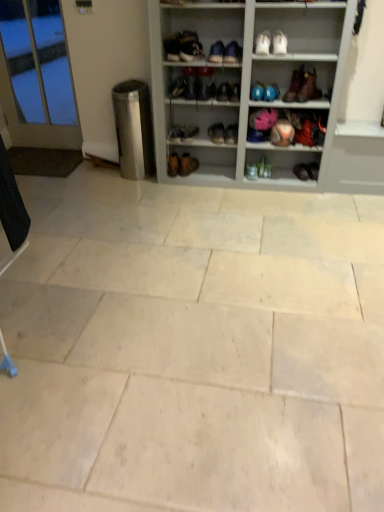
What do you see at coordinates (257, 91) in the screenshot? Image resolution: width=384 pixels, height=512 pixels. I see `blue matte shoes at upper center, marked as the 6th footwear in a left-to-right arrangement` at bounding box center [257, 91].

Describe the element at coordinates (235, 92) in the screenshot. I see `matte black shoe at center, which ranks as the 3th shoe in right-to-left order` at that location.

Find the location of a particular element. The height and width of the screenshot is (512, 384). matte pink shoe at upper right, positioned as the 3th footwear in right-to-left order is located at coordinates (294, 85).

This screenshot has height=512, width=384. Describe the element at coordinates (263, 42) in the screenshot. I see `white matte shoe at upper center, which is counted as the 6th footwear, starting from the right` at that location.

From the picture: Measure the distance between point (262, 47) and camera.

9.19 feet.

I want to click on blue matte shoes at upper center, which is the 5th footwear in right-to-left order, so click(257, 91).

Which is less distant, [233,93] or [182,80]?

Point [233,93]

Is matte black shoe at center, the 4th shoe when ordered from left to right, at the right side of matte black shoe at center, placed as the first shoe when sorted from left to right?

Yes, matte black shoe at center, the 4th shoe when ordered from left to right, is to the right of matte black shoe at center, placed as the first shoe when sorted from left to right.

From a real-world perspective, is matte black shoe at center, which ranks as the 3th shoe in right-to-left order, on top of matte black shoe at center, which is the 6th shoe from right to left?

No, from a real-world perspective, matte black shoe at center, which ranks as the 3th shoe in right-to-left order, is not above matte black shoe at center, which is the 6th shoe from right to left.

Who is bigger, matte black shoe at center, which ranks as the 3th shoe in right-to-left order, or matte black shoe at center, placed as the first shoe when sorted from left to right?

matte black shoe at center, placed as the first shoe when sorted from left to right, is bigger.

Is leather boot at center, acting as the eighth footwear starting from the right, at the right side of blue matte bowling ball at upper center, placed as the 5th shoe when sorted from left to right?

Incorrect, leather boot at center, acting as the eighth footwear starting from the right, is not on the right side of blue matte bowling ball at upper center, placed as the 5th shoe when sorted from left to right.

Considering the positions of objects leather boot at center, which appears as the third footwear when viewed from the left, and blue matte bowling ball at upper center, the second shoe viewed from the right, in the image provided, who is behind, leather boot at center, which appears as the third footwear when viewed from the left, or blue matte bowling ball at upper center, the second shoe viewed from the right,?

leather boot at center, which appears as the third footwear when viewed from the left, is further away from the camera.

Identify the location of shoe that is the 3rd one when counting rightward from the leather boot at center, which appears as the third footwear when viewed from the left. The height and width of the screenshot is (512, 384). (271, 92).

From the image's perspective, between leather boot at center, acting as the eighth footwear starting from the right, and blue matte bowling ball at upper center, the second shoe viewed from the right, who is located below?

leather boot at center, acting as the eighth footwear starting from the right, from the image's perspective.

Is matte black boot at upper center, which is counted as the 4th footwear, starting from the right, looking in the opposite direction of matte black shoe at center, which ranks as the 3th shoe in right-to-left order?

No, matte black boot at upper center, which is counted as the 4th footwear, starting from the right, is not facing the opposite direction of matte black shoe at center, which ranks as the 3th shoe in right-to-left order.

Between matte black boot at upper center, which is counted as the 4th footwear, starting from the right, and matte black shoe at center, the 4th shoe when ordered from left to right, which one has more height?

With more height is matte black shoe at center, the 4th shoe when ordered from left to right.

From the image's perspective, does matte black boot at upper center, the 7th footwear in the left-to-right sequence, appear higher than matte black shoe at center, which ranks as the 3th shoe in right-to-left order?

Yes, from the image's perspective, matte black boot at upper center, the 7th footwear in the left-to-right sequence, is on top of matte black shoe at center, which ranks as the 3th shoe in right-to-left order.

Are matte black boot at upper center, which is counted as the 4th footwear, starting from the right, and matte black shoe at center, the 4th shoe when ordered from left to right, located far from each other?

Answer: No, matte black boot at upper center, which is counted as the 4th footwear, starting from the right, is in close proximity to matte black shoe at center, the 4th shoe when ordered from left to right.

In the scene shown: Could you tell me if matte pink shoe at upper right, positioned as the 3th footwear in right-to-left order, is turned towards natural stone tile at center?

No, matte pink shoe at upper right, positioned as the 3th footwear in right-to-left order, is not turned towards natural stone tile at center.

From a real-world perspective, who is located higher, matte pink shoe at upper right, positioned as the 3th footwear in right-to-left order, or natural stone tile at center?

matte pink shoe at upper right, positioned as the 3th footwear in right-to-left order, is physically above.

From the image's perspective, who appears lower, matte pink shoe at upper right, positioned as the 3th footwear in right-to-left order, or natural stone tile at center?

From the image's view, natural stone tile at center is below.

Looking at this image, how different are the orientations of matte blue shoe at center, positioned as the 4th footwear in left-to-right order, and leather boot at center, acting as the eighth footwear starting from the right, in degrees?

12.2 degrees.

From a real-world perspective, between matte blue shoe at center, positioned as the 4th footwear in left-to-right order, and leather boot at center, acting as the eighth footwear starting from the right, who is vertically higher?

leather boot at center, acting as the eighth footwear starting from the right, is physically above.

In the scene shown: From the image's perspective, is matte blue shoe at center, which is the seventh footwear from right to left, located above or below leather boot at center, acting as the eighth footwear starting from the right?

Clearly, from the image's perspective, matte blue shoe at center, which is the seventh footwear from right to left, is below leather boot at center, acting as the eighth footwear starting from the right.

Looking at this image, between matte black shoe at center, which appears as the third shoe when viewed from the left, and leather boot at center, acting as the eighth footwear starting from the right, which one has larger width?

leather boot at center, acting as the eighth footwear starting from the right.

From the picture: Can you confirm if matte black shoe at center, which appears as the third shoe when viewed from the left, is bigger than leather boot at center, which appears as the third footwear when viewed from the left?

Incorrect, matte black shoe at center, which appears as the third shoe when viewed from the left, is not larger than leather boot at center, which appears as the third footwear when viewed from the left.

Is matte black shoe at center, which is the 4th shoe in right-to-left order, oriented away from leather boot at center, acting as the eighth footwear starting from the right?

No, matte black shoe at center, which is the 4th shoe in right-to-left order, is not facing away from leather boot at center, acting as the eighth footwear starting from the right.

Based on the photo, considering their positions, is matte black shoe at center, which is the 4th shoe in right-to-left order, located in front of or behind leather boot at center, acting as the eighth footwear starting from the right?

Visually, matte black shoe at center, which is the 4th shoe in right-to-left order, is located in front of leather boot at center, acting as the eighth footwear starting from the right.

Is brown leather boot at upper right, the 2th footwear from the right, shorter than matte pink shoe at upper right, which appears as the eighth footwear when viewed from the left?

In fact, brown leather boot at upper right, the 2th footwear from the right, may be taller than matte pink shoe at upper right, which appears as the eighth footwear when viewed from the left.

Is brown leather boot at upper right, the 2th footwear from the right, at the left side of matte pink shoe at upper right, which appears as the eighth footwear when viewed from the left?

No.

Considering the positions of objects brown leather boot at upper right, the 9th footwear when ordered from left to right, and matte pink shoe at upper right, which appears as the eighth footwear when viewed from the left, in the image provided, who is behind, brown leather boot at upper right, the 9th footwear when ordered from left to right, or matte pink shoe at upper right, which appears as the eighth footwear when viewed from the left,?

matte pink shoe at upper right, which appears as the eighth footwear when viewed from the left, is further away from the camera.

Is brown leather boot at upper right, the 9th footwear when ordered from left to right, thinner than matte pink shoe at upper right, positioned as the 3th footwear in right-to-left order?

Incorrect, the width of brown leather boot at upper right, the 9th footwear when ordered from left to right, is not less than that of matte pink shoe at upper right, positioned as the 3th footwear in right-to-left order.

Identify the location of the 2nd shoe behind the matte black shoe at center, which ranks as the 3th shoe in right-to-left order, starting your count from the anchor. Image resolution: width=384 pixels, height=512 pixels. (177, 87).

Locate an element on the screen. the 4th shoe in front of the leather boot at center, acting as the eighth footwear starting from the right is located at coordinates (271, 92).

Which object lies further to the anchor point clear glass door at left, matte black shoe at center, the tenth footwear from the left, or natural stone tile at center?

Based on the image, matte black shoe at center, the tenth footwear from the left, appears to be further to clear glass door at left.

When comparing their distances from blue matte bowling ball at upper center, placed as the 5th shoe when sorted from left to right, does natural stone tile at center or matte pink shoe at upper right, positioned as the 3th footwear in right-to-left order, seem closer?

matte pink shoe at upper right, positioned as the 3th footwear in right-to-left order.

When comparing their distances from blue matte bowling ball at upper center, the second shoe viewed from the right, does matte pink shoe at upper right, which appears as the eighth footwear when viewed from the left, or natural stone tile at center seem further?

Among the two, natural stone tile at center is located further to blue matte bowling ball at upper center, the second shoe viewed from the right.

Based on their spatial positions, is white leather shoe at upper center, which is the second shoe from left to right, or matte black boot at upper center, which is counted as the 4th footwear, starting from the right, closer to clear glass door at left?

Based on the image, white leather shoe at upper center, which is the second shoe from left to right, appears to be nearer to clear glass door at left.

Which object lies nearer to the anchor point brown leather boot at upper right, the 9th footwear when ordered from left to right, brown leather boot at center, which is the 1th footwear in left-to-right order, or white leather shoe at upper center, which is the second shoe from left to right?

white leather shoe at upper center, which is the second shoe from left to right.

From the image, which object appears to be nearer to blue matte shoes at upper center, which is the 5th footwear in right-to-left order, matte black shoe at center, which ranks as the 3th shoe in right-to-left order, or matte blue shoe at center, positioned as the 4th footwear in left-to-right order?

matte black shoe at center, which ranks as the 3th shoe in right-to-left order, is positioned closer to the anchor blue matte shoes at upper center, which is the 5th footwear in right-to-left order.

From the image, which object appears to be nearer to matte blue shoe at center, the 1th shoe in the right-to-left sequence, clear glass door at left or brown leather boot at center, which is the 1th footwear in left-to-right order?

Among the two, brown leather boot at center, which is the 1th footwear in left-to-right order, is located nearer to matte blue shoe at center, the 1th shoe in the right-to-left sequence.

Estimate the real-world distances between objects in this image. Which object is further from natural stone tile at center, white matte shoe at upper center, which is the fifth footwear from left to right, or matte black shoe at center, which ranks as the 3th shoe in right-to-left order?

Based on the image, white matte shoe at upper center, which is the fifth footwear from left to right, appears to be further to natural stone tile at center.

Find the location of `shoe that lies between matte black shoe at center, which ranks as the 3th shoe in right-to-left order, and matte blue shoe at center, the 1th shoe in the right-to-left sequence, from top to bottom`. shoe that lies between matte black shoe at center, which ranks as the 3th shoe in right-to-left order, and matte blue shoe at center, the 1th shoe in the right-to-left sequence, from top to bottom is located at coordinates (271, 92).

Locate an element on the screen. shoe between matte black shoe at center, which is the 4th shoe in right-to-left order, and blue matte shoes at upper center, marked as the 6th footwear in a left-to-right arrangement is located at coordinates (235, 92).

Identify the location of shoe situated between white leather shoe at upper center, which is the second shoe from left to right, and matte black shoe at center, the 4th shoe when ordered from left to right, from left to right. (224, 92).

The image size is (384, 512). Find the location of `footwear between clear glass door at left and matte black shoe at upper center, marked as the 9th footwear in a right-to-left arrangement, in the horizontal direction`. footwear between clear glass door at left and matte black shoe at upper center, marked as the 9th footwear in a right-to-left arrangement, in the horizontal direction is located at coordinates (182, 164).